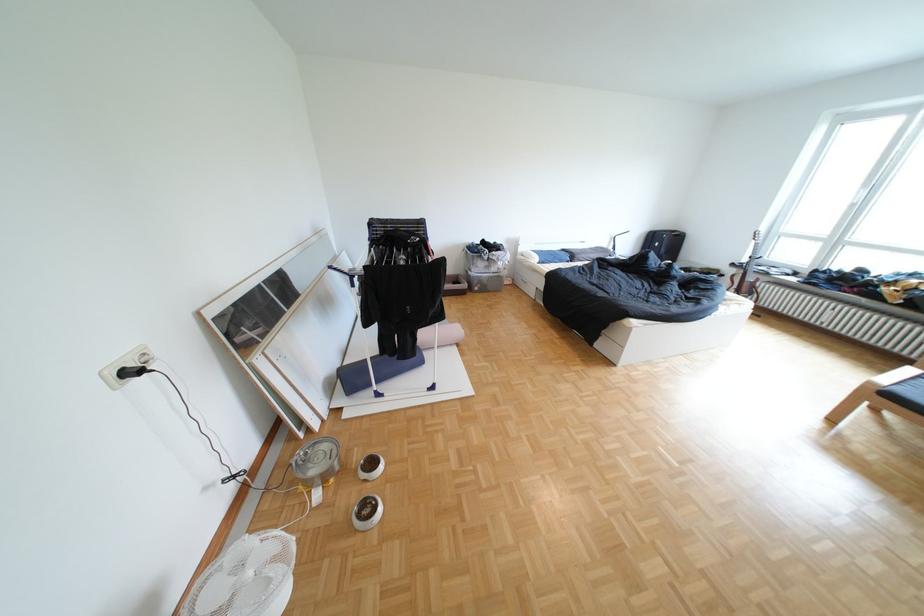
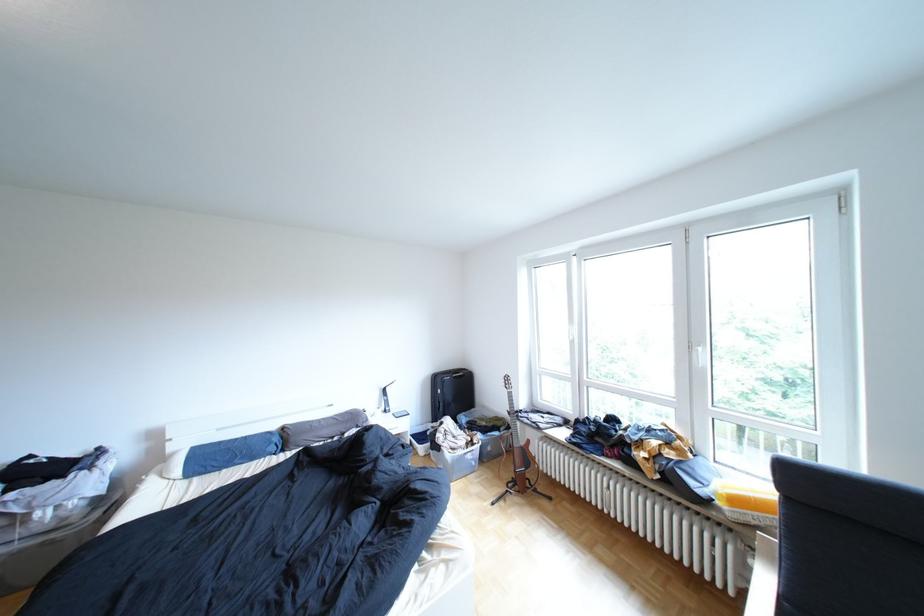
Where in the second image is the point corresponding to point 761,285 from the first image?

(532, 453)